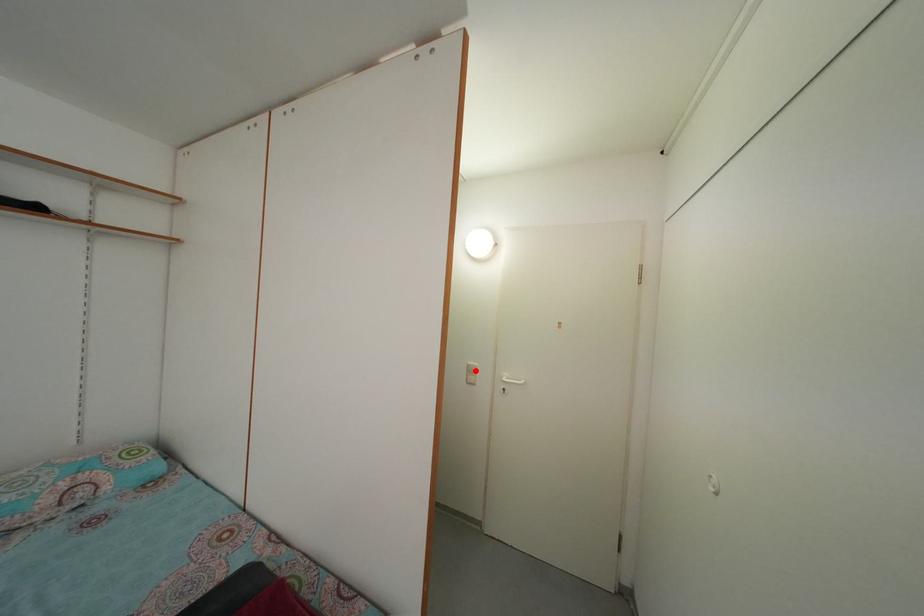
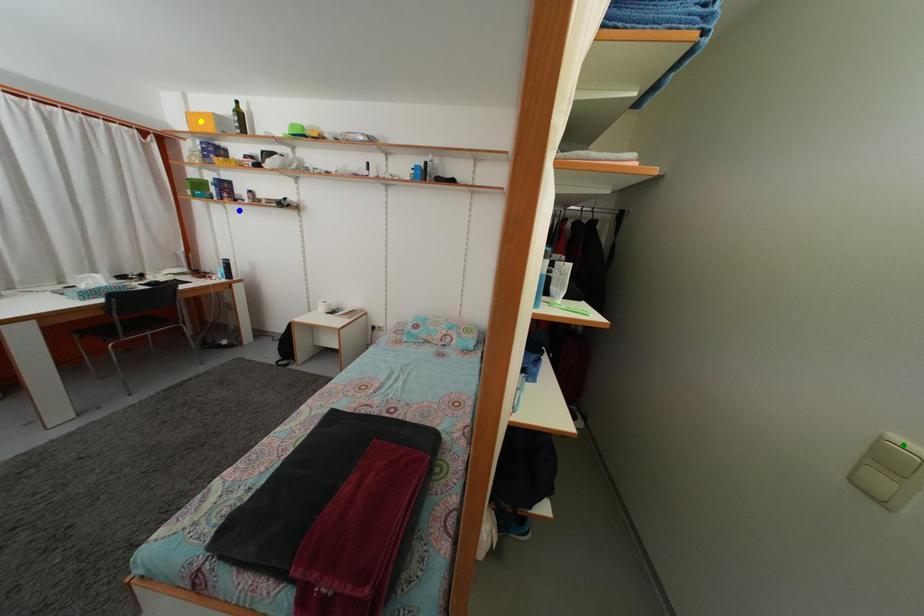
Question: I am providing you with two images of the same scene from different viewpoints. A red point is marked on the first image. You are given multiple points on the second image. Which mark in image 2 goes with the point in image 1?

Choices:
 (A) yellow point
 (B) blue point
 (C) green point

Answer: (C)